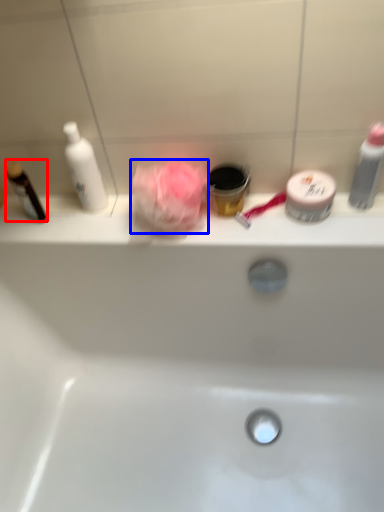
Question: Which of the following is the closest to the observer, toiletry (highlighted by a red box) or rose (highlighted by a blue box)?

Choices:
 (A) toiletry
 (B) rose

Answer: (B)